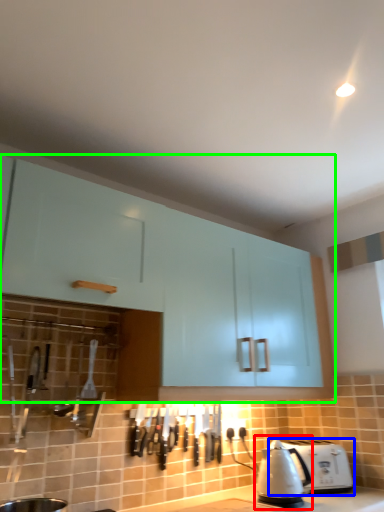
Question: Which is nearer to the kettle (highlighted by a red box)? toaster (highlighted by a blue box) or cabinetry (highlighted by a green box).

Choices:
 (A) toaster
 (B) cabinetry

Answer: (A)